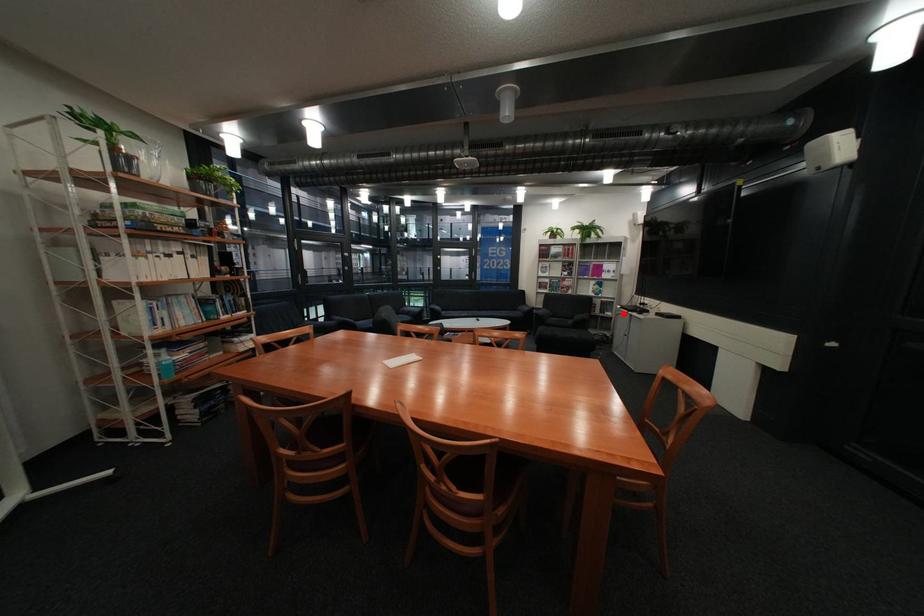
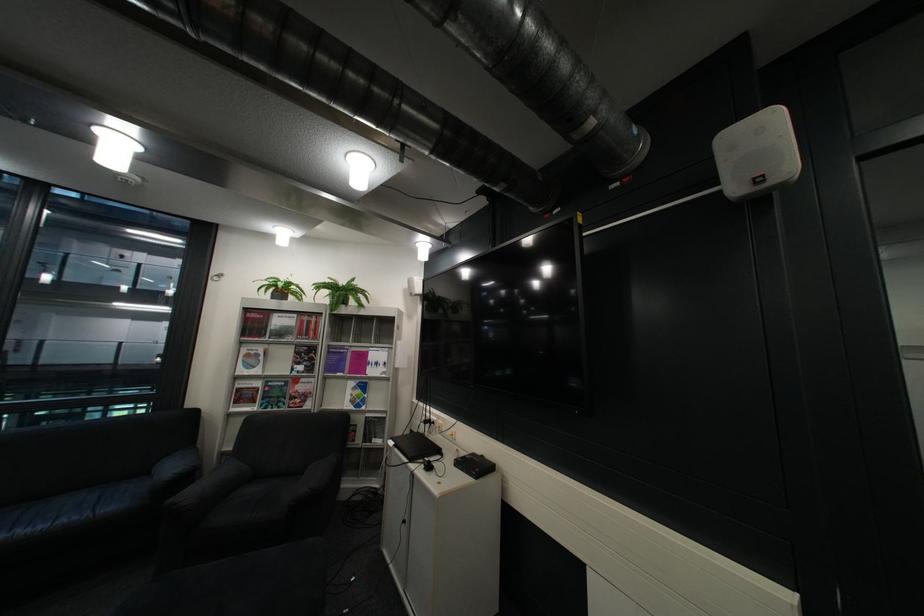
Question: A red point is marked in image1. In image2, is the corresponding 3D point closer to the camera or farther? Reply with the corresponding letter.

Choices:
 (A) The corresponding 3D point is closer.
 (B) The corresponding 3D point is farther.

Answer: (B)